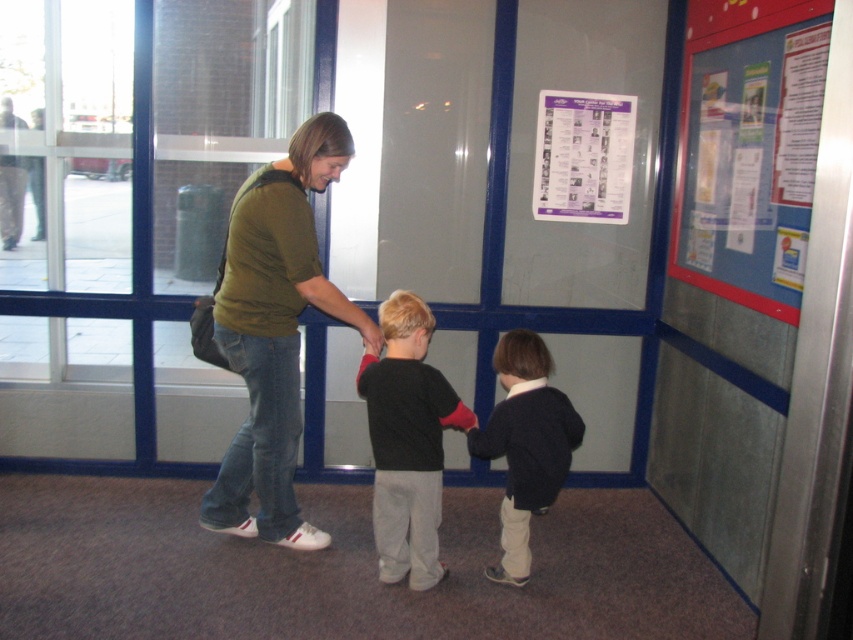
The image size is (853, 640). What do you see at coordinates (276, 330) in the screenshot? I see `green cotton shirt at center` at bounding box center [276, 330].

Between green cotton shirt at center and purple paper poster at upper center, which one has more height?

green cotton shirt at center

The height and width of the screenshot is (640, 853). I want to click on green cotton shirt at center, so click(x=276, y=330).

Which of these two, blue fabric bulletin board at upper right or dark blue sweater at center, stands taller?

With more height is blue fabric bulletin board at upper right.

How distant is blue fabric bulletin board at upper right from dark blue sweater at center?

The distance of blue fabric bulletin board at upper right from dark blue sweater at center is 39.15 inches.

This screenshot has height=640, width=853. What do you see at coordinates (749, 148) in the screenshot?
I see `blue fabric bulletin board at upper right` at bounding box center [749, 148].

You are a GUI agent. You are given a task and a screenshot of the screen. Output one action in this format:
    pyautogui.click(x=<x>, y=<y>)
    Task: Click on the blue fabric bulletin board at upper right
    The image size is (853, 640).
    Given the screenshot: What is the action you would take?
    pyautogui.click(x=749, y=148)

At what (x,y) coordinates should I click in order to perform the action: click on blue fabric bulletin board at upper right. Please return your answer as a coordinate pair (x, y). This screenshot has width=853, height=640. Looking at the image, I should click on (749, 148).

Which is below, blue fabric bulletin board at upper right or black cotton shirt at center?

black cotton shirt at center

This screenshot has height=640, width=853. Find the location of `blue fabric bulletin board at upper right`. blue fabric bulletin board at upper right is located at coordinates (749, 148).

The image size is (853, 640). In order to click on blue fabric bulletin board at upper right in this screenshot , I will do `click(749, 148)`.